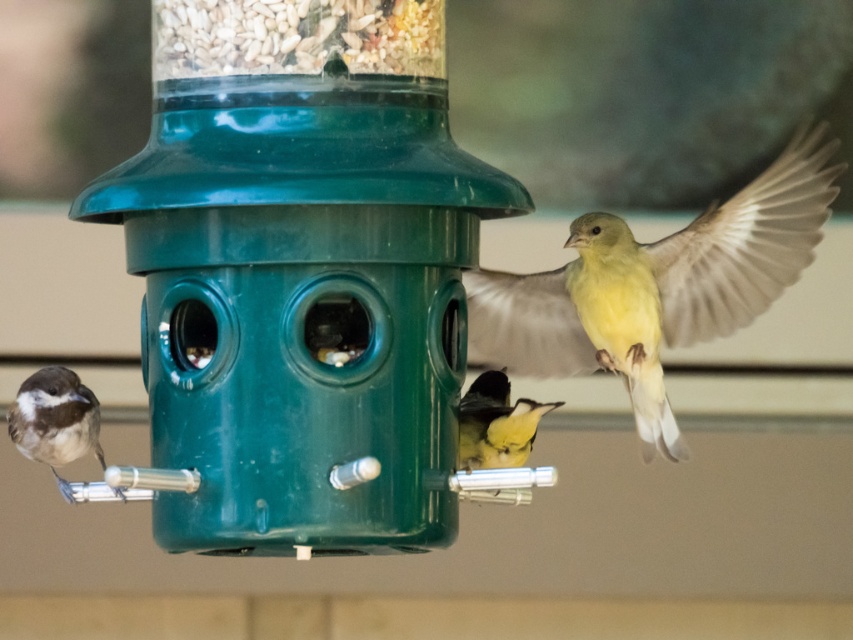
Does green plastic bird feeder at center come in front of brown speckled feathers at left?

Yes, it is in front of brown speckled feathers at left.

Between green plastic bird feeder at center and brown speckled feathers at left, which one is positioned higher?

green plastic bird feeder at center is above.

The width and height of the screenshot is (853, 640). In order to click on green plastic bird feeder at center in this screenshot , I will do `click(303, 276)`.

Is point (160, 74) less distant than point (73, 385)?

Yes, it is.

Is grainy seeds at top center further to the viewer compared to brown speckled feathers at left?

That is False.

The image size is (853, 640). What do you see at coordinates (296, 36) in the screenshot? I see `grainy seeds at top center` at bounding box center [296, 36].

At what (x,y) coordinates should I click in order to perform the action: click on grainy seeds at top center. Please return your answer as a coordinate pair (x, y). The image size is (853, 640). Looking at the image, I should click on (296, 36).

Does green plastic bird feeder at center have a smaller size compared to yellow matte bird at upper right?

Incorrect, green plastic bird feeder at center is not smaller in size than yellow matte bird at upper right.

Identify the location of green plastic bird feeder at center. (303, 276).